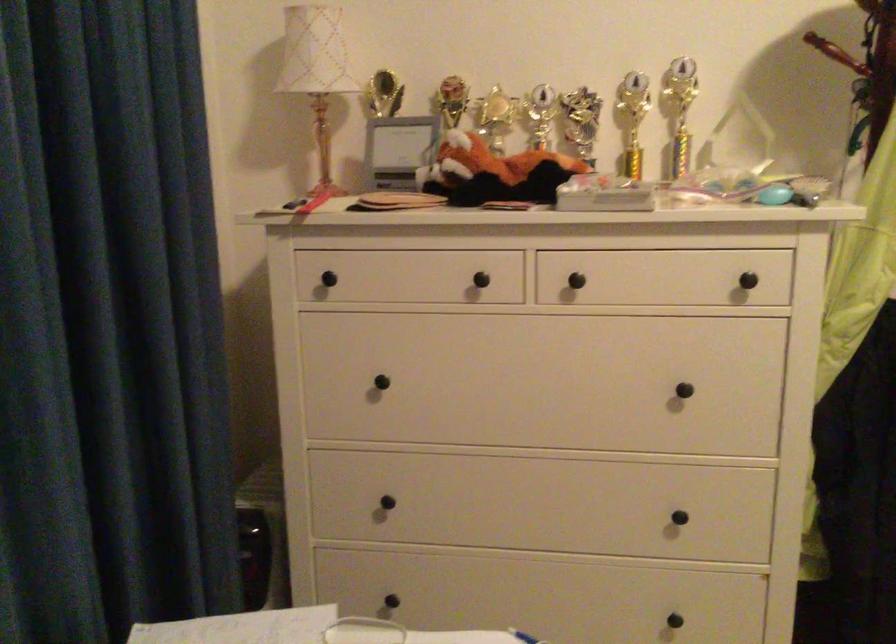
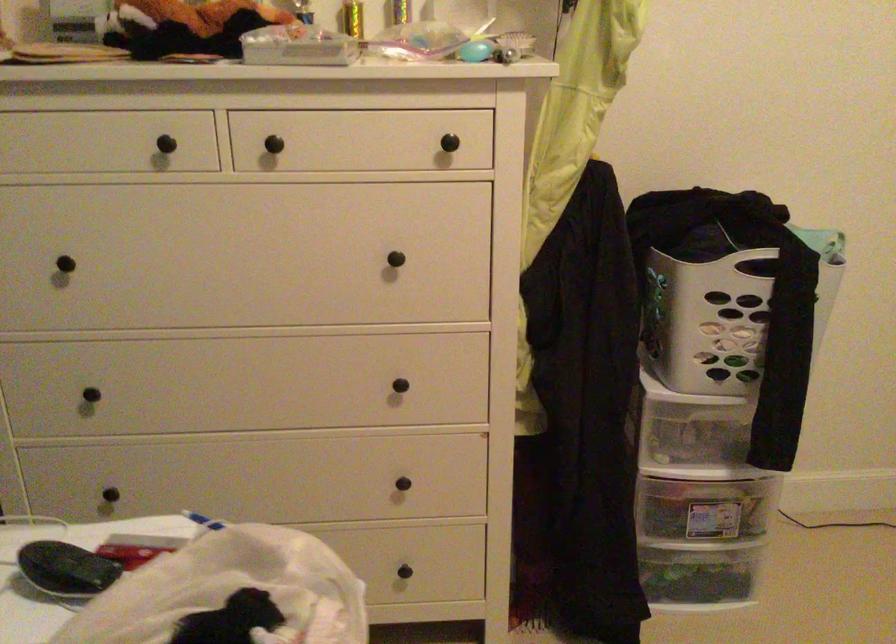
In the second image, find the point that corresponds to point 565,278 in the first image.

(261, 140)